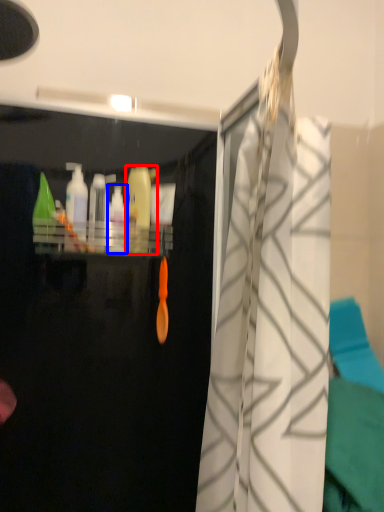
Question: Which object is closer to the camera taking this photo, cleaning product (highlighted by a red box) or cleaning product (highlighted by a blue box)?

Choices:
 (A) cleaning product
 (B) cleaning product

Answer: (B)